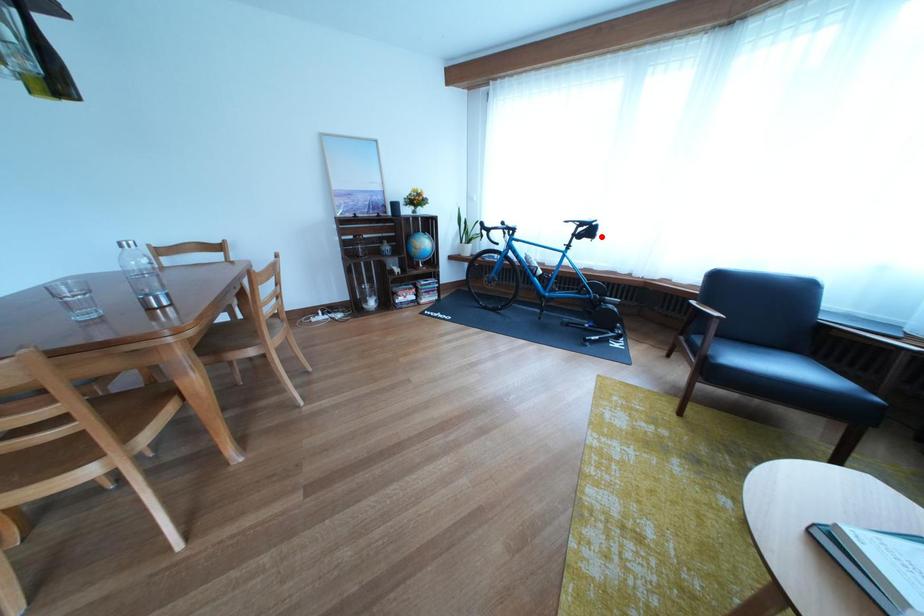
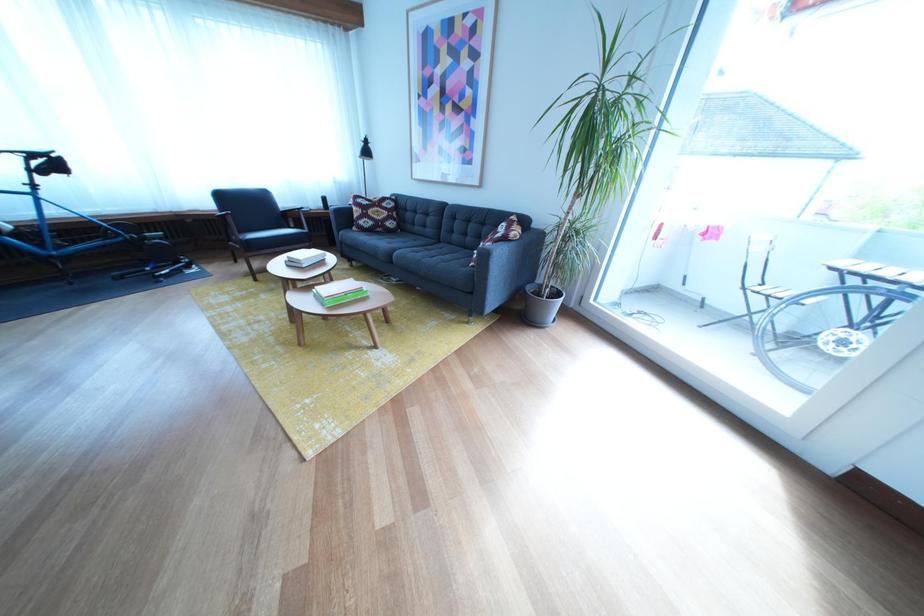
Question: I am providing you with two images of the same scene from different viewpoints. In image1, a red point is highlighted. Considering the same 3D point in image2, which of the following is correct?

Choices:
 (A) It is closer
 (B) It is farther

Answer: (B)